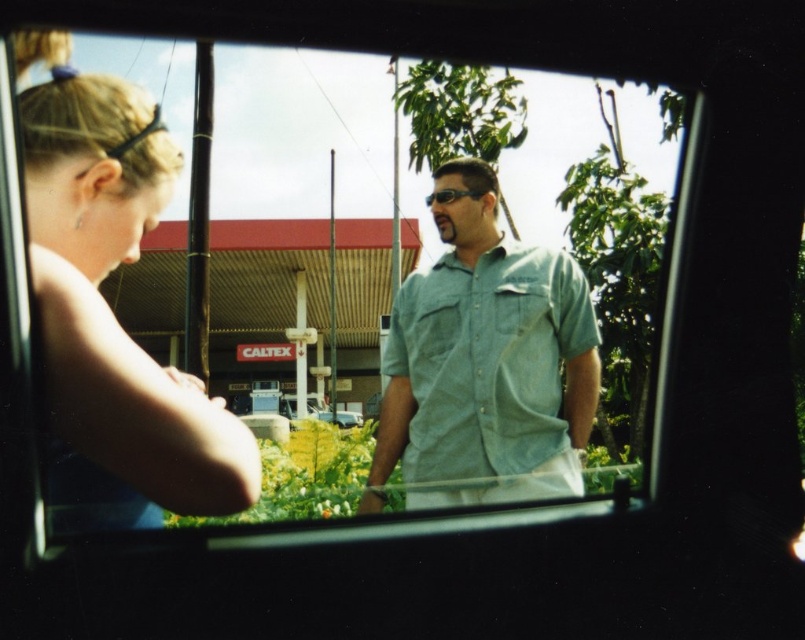
Question: Estimate the real-world distances between objects in this image. Which object is farther from the matte black sunglasses at center?

Choices:
 (A) transparent glass car window at center
 (B) denim shirt at center
 (C) blonde hair at left

Answer: (A)

Question: Which point is closer to the camera taking this photo?

Choices:
 (A) (471, 177)
 (B) (510, 492)
 (C) (440, 202)
 (D) (143, 140)

Answer: (D)

Question: Does blonde hair at left have a smaller size compared to denim shirt at center?

Choices:
 (A) no
 (B) yes

Answer: (B)

Question: Which is farther from the matte black sunglasses at center?

Choices:
 (A) transparent glass car window at center
 (B) blonde hair at left
 (C) denim shirt at center

Answer: (A)

Question: Is transparent glass car window at center to the right of denim shirt at center from the viewer's perspective?

Choices:
 (A) yes
 (B) no

Answer: (B)

Question: Does transparent glass car window at center appear on the right side of matte black sunglasses at center?

Choices:
 (A) yes
 (B) no

Answer: (B)